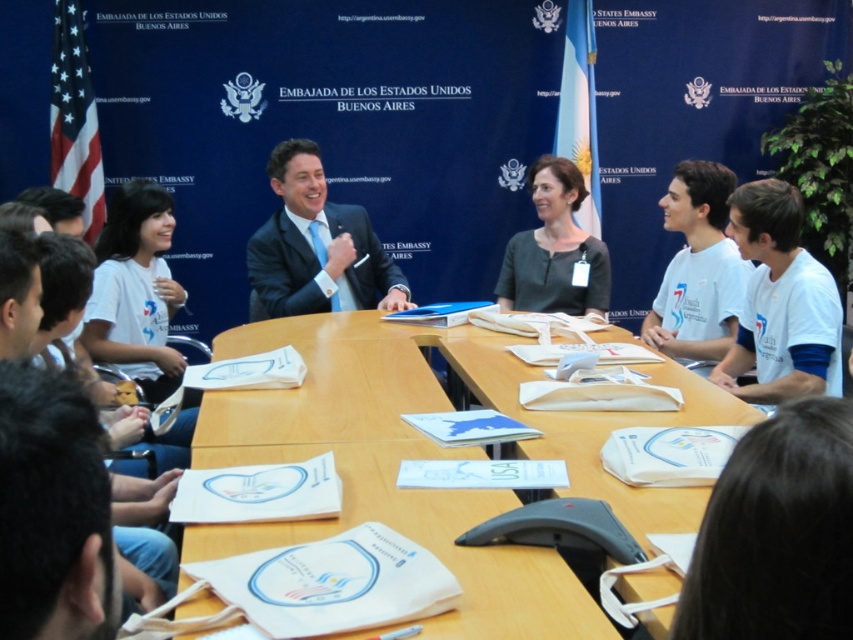
You are an event organizer at the U.S. Embassy in Buenos Aires. You need to ensure that the shiny blue suit at center and the dark gray shirt at center can both fit on a display rack that is 1.2 meters wide. Based on their sizes, will they both fit?

The shiny blue suit at center has a larger width than the dark gray shirt at center. However, without knowing the exact widths of both items, it is impossible to determine if their combined width will exceed the 1.2 meter rack. Additional measurements are needed.

In the image of the U.S. Embassy meeting, there is a point labeled at coordinate [53,512]. What does this point represent?

The point at coordinate [53,512] represents dark brown hair at lower left.

You are an embassy staff member standing at the dark brown hair at lower left and need to place a document on the wooden table at center. In which direction should you move to reach the table?

The wooden table at center is positioned on the right side of dark brown hair at lower left, so you should move to your right to reach the table.